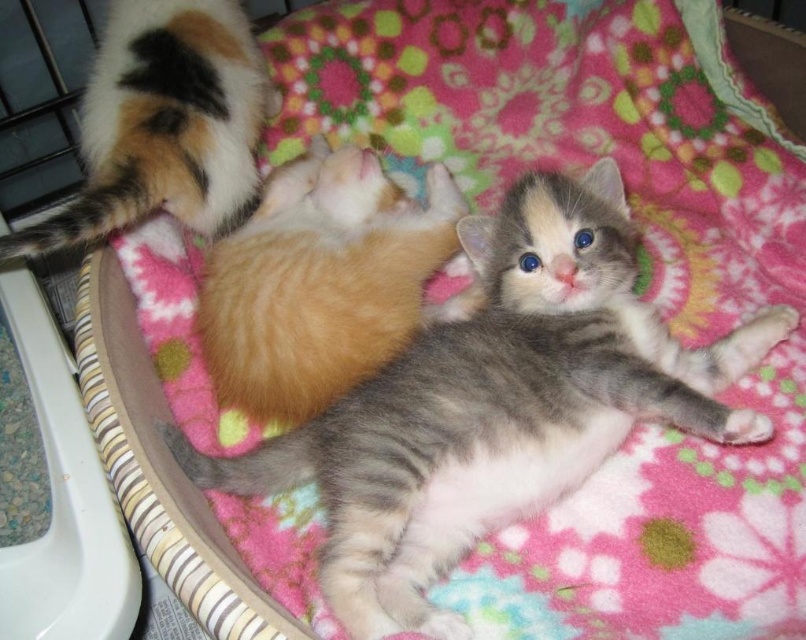
You are a cat owner who wants to place a small toy between the fluffy gray kitten at center and the calico fur tail at upper left. Based on their sizes, which kitten will the toy be closer to?

The fluffy gray kitten at center is bigger than the calico fur tail at upper left, so the toy placed between them will be closer to the smaller calico fur tail at upper left.

Looking at this image, you are observing two kittens on a colorful blanket. There is a fluffy gray kitten at center and another kitten partially visible behind it. Based on their positions, which kitten is closer to you?

The fluffy gray kitten at center is closer to you because it is located at point 0.615, which is closer to the viewer compared to the other kitten that is partially visible behind it.

You are a photographer setting up a camera to capture both the fluffy gray kitten at center and the orange fur cat at center on the blanket. Based on their sizes, which kitten should you focus on first to ensure both fit in the frame?

The fluffy gray kitten at center is larger than the orange fur cat at center, so you should focus on the fluffy gray kitten at center first to ensure both fit in the frame by centering it and adjusting the zoom accordingly.